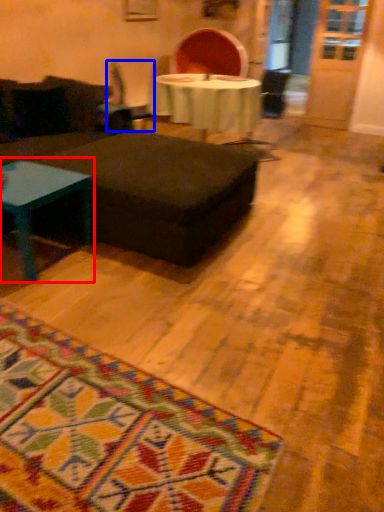
Question: Which object is further to the camera taking this photo, coffee table (highlighted by a red box) or swivel chair (highlighted by a blue box)?

Choices:
 (A) coffee table
 (B) swivel chair

Answer: (B)